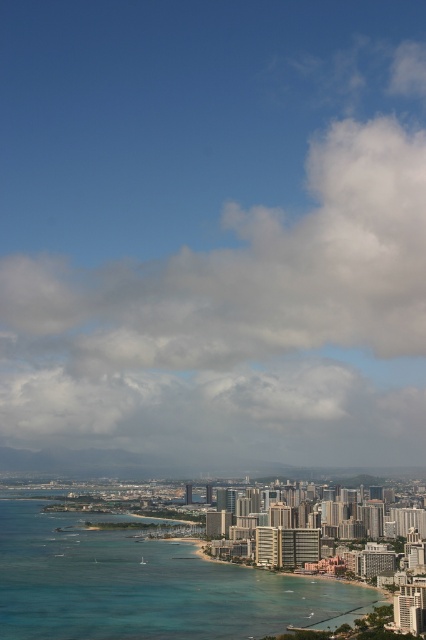
Question: Can you confirm if white fluffy cloud at upper center is positioned to the right of clear blue water at lower center?

Choices:
 (A) no
 (B) yes

Answer: (B)

Question: Does white fluffy cloud at upper center appear over clear blue water at lower center?

Choices:
 (A) yes
 (B) no

Answer: (A)

Question: Which object appears closest to the camera in this image?

Choices:
 (A) clear blue water at lower center
 (B) white fluffy cloud at upper center

Answer: (B)

Question: Does white fluffy cloud at upper center appear over clear blue water at lower center?

Choices:
 (A) yes
 (B) no

Answer: (A)

Question: Which point appears farthest from the camera in this image?

Choices:
 (A) (103, 561)
 (B) (307, 376)

Answer: (A)